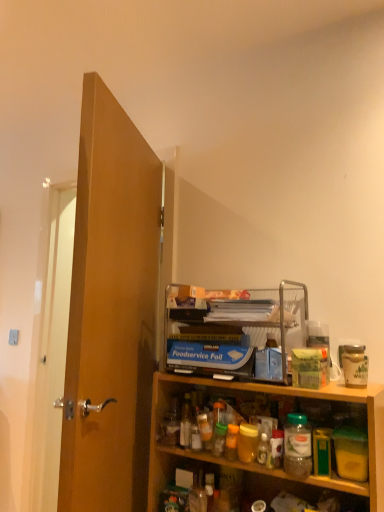
Question: From a real-world perspective, relative to blue cardboard foodservice foil at upper center, is wooden cabinet at lower right vertically above or below?

Choices:
 (A) below
 (B) above

Answer: (A)

Question: In terms of height, does wooden cabinet at lower right look taller or shorter compared to blue cardboard foodservice foil at upper center?

Choices:
 (A) short
 (B) tall

Answer: (B)

Question: Considering the real-world distances, which object is farthest from the wooden door at left?

Choices:
 (A) wooden cabinet at lower right
 (B) blue cardboard foodservice foil at upper center

Answer: (A)

Question: Which object is positioned farthest from the blue cardboard foodservice foil at upper center?

Choices:
 (A) wooden door at left
 (B) wooden cabinet at lower right

Answer: (A)